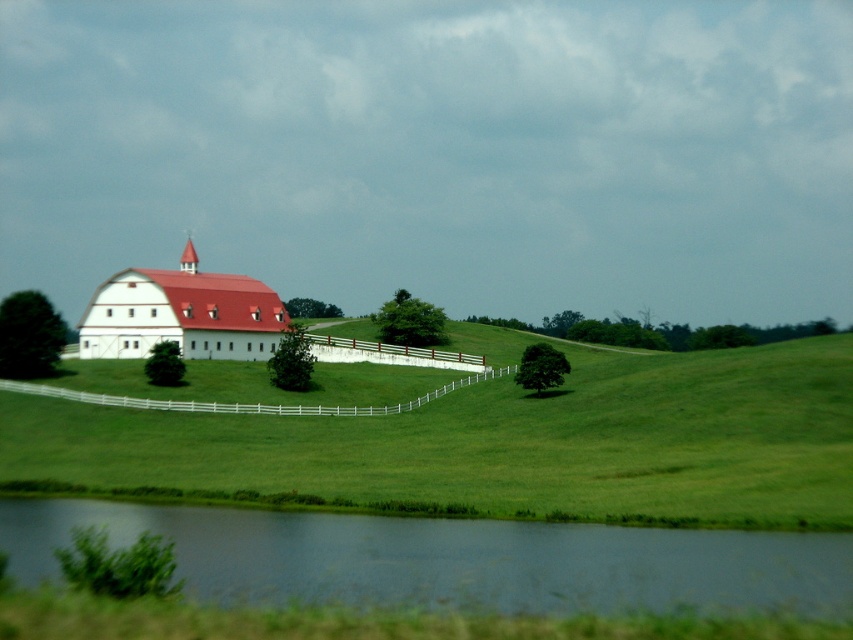
The image size is (853, 640). I want to click on smooth reflective water at lower center, so point(451,560).

Who is positioned more to the right, smooth reflective water at lower center or white wooden fence at center?

Positioned to the right is smooth reflective water at lower center.

At what (x,y) coordinates should I click in order to perform the action: click on smooth reflective water at lower center. Please return your answer as a coordinate pair (x, y). This screenshot has width=853, height=640. Looking at the image, I should click on (451, 560).

Between matte white barn at center and white wooden fence at center, which one is positioned higher?

matte white barn at center is higher up.

What do you see at coordinates (181, 314) in the screenshot? I see `matte white barn at center` at bounding box center [181, 314].

Image resolution: width=853 pixels, height=640 pixels. I want to click on matte white barn at center, so click(x=181, y=314).

Does green grassy at center have a lesser height compared to smooth reflective water at lower center?

In fact, green grassy at center may be taller than smooth reflective water at lower center.

Between green grassy at center and smooth reflective water at lower center, which one appears on the left side from the viewer's perspective?

smooth reflective water at lower center is more to the left.

Who is more forward, (675, 429) or (763, 605)?

Point (763, 605) is more forward.

The height and width of the screenshot is (640, 853). In order to click on green grassy at center in this screenshot , I will do `click(498, 444)`.